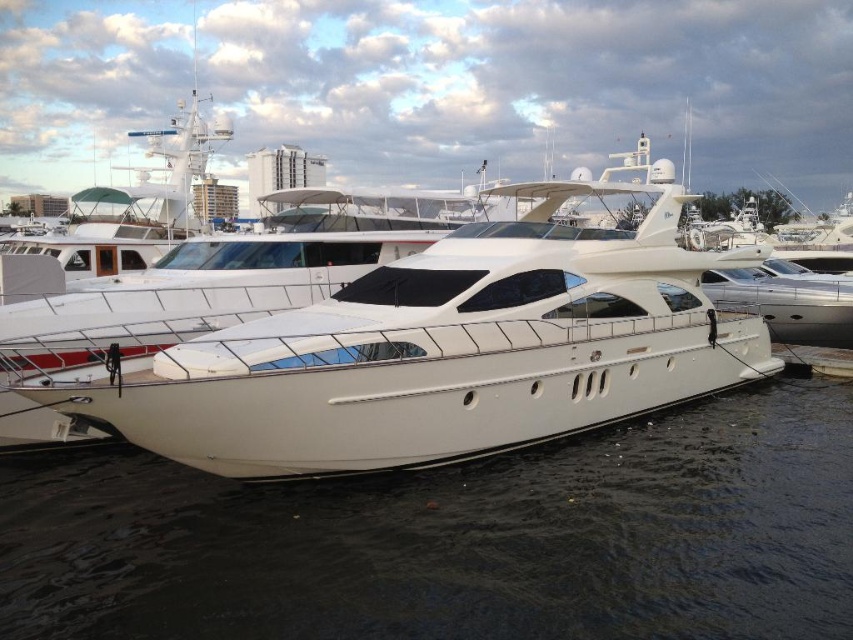
How far apart are white glossy water at lower center and white glossy yacht at center?

The distance of white glossy water at lower center from white glossy yacht at center is 7.31 meters.

Who is shorter, white glossy water at lower center or white glossy yacht at center?

Standing shorter between the two is white glossy water at lower center.

Is point (242, 620) in front of point (262, 339)?

That is True.

In order to click on white glossy water at lower center in this screenshot , I will do `click(457, 538)`.